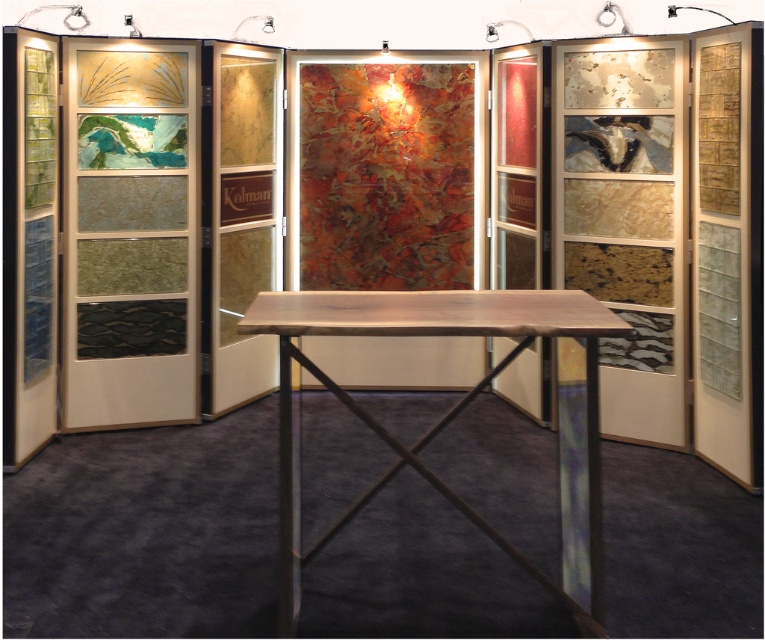
Question: Does translucent glass at left have a larger size compared to wooden table at center?

Choices:
 (A) yes
 (B) no

Answer: (B)

Question: Does translucent glass at left have a greater width compared to wooden table at center?

Choices:
 (A) no
 (B) yes

Answer: (A)

Question: Can you confirm if translucent glass at left is positioned to the right of wooden table at center?

Choices:
 (A) yes
 (B) no

Answer: (B)

Question: Which of the following is the closest to the observer?

Choices:
 (A) wooden table at center
 (B) translucent glass at left

Answer: (A)